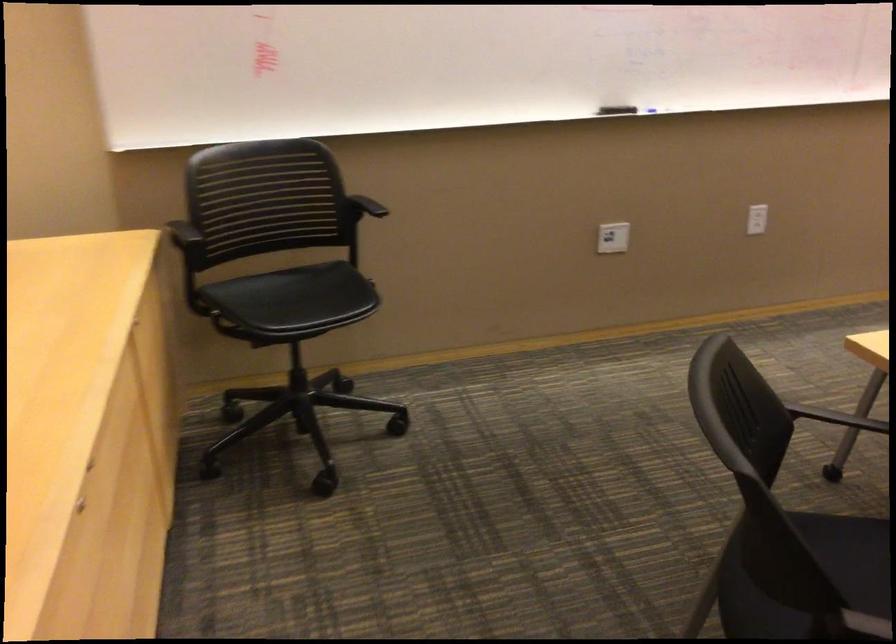
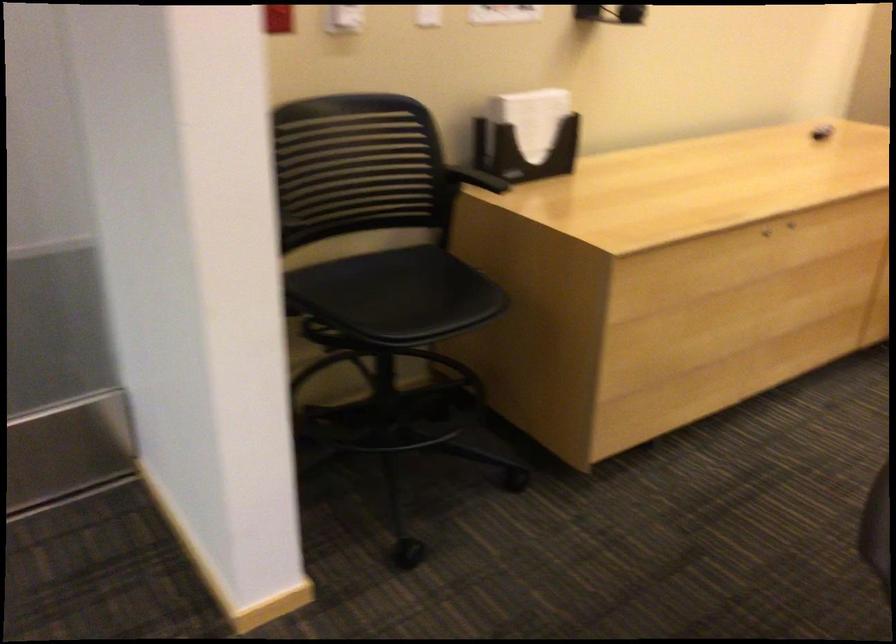
Where in the second image is the point corresponding to point 104,507 from the first image?

(790, 225)